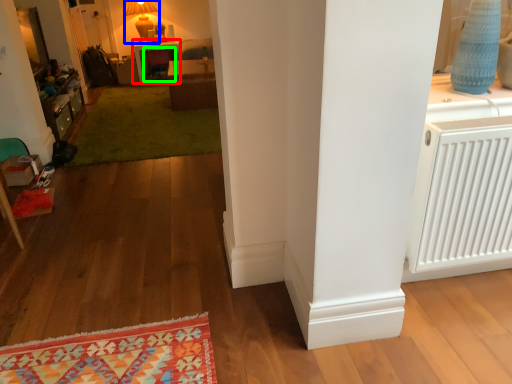
Question: Which is nearer to the table (highlighted by a red box)? lamp (highlighted by a blue box) or armchair (highlighted by a green box).

Choices:
 (A) lamp
 (B) armchair

Answer: (B)